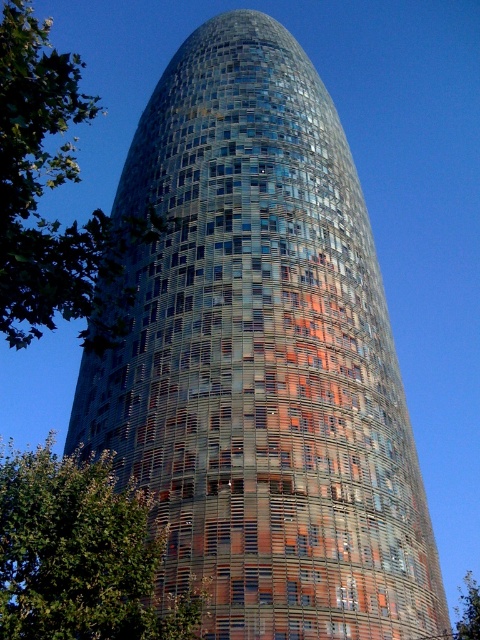
Which is in front, point (93, 275) or point (49, 541)?

Point (93, 275) is more forward.

Does green leafy tree at left have a greater height compared to green leafy tree at lower left?

Yes.

Is point (57, 58) positioned before point (134, 509)?

That is True.

This screenshot has height=640, width=480. Identify the location of green leafy tree at left. (54, 188).

Who is lower down, green leafy tree at left or green leafy tree at upper left?

green leafy tree at upper left is below.

The width and height of the screenshot is (480, 640). In order to click on green leafy tree at left in this screenshot , I will do `click(54, 188)`.

Based on the photo, between green leafy tree at lower left and green leafy tree at upper left, which one is positioned higher?

Positioned higher is green leafy tree at lower left.

Is point (20, 564) positioned in front of point (464, 636)?

Yes, it is in front of point (464, 636).

Find the location of a particular element. The image size is (480, 640). green leafy tree at lower left is located at coordinates (82, 554).